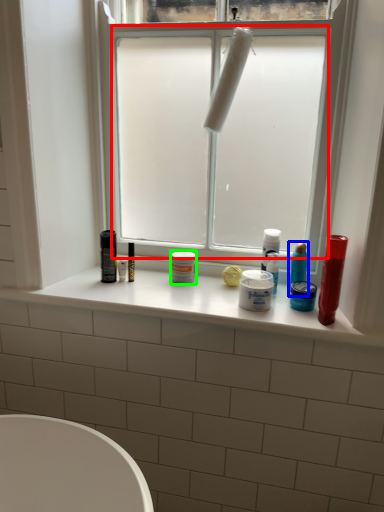
Question: Which is nearer to the window screen (highlighted by a red box)? toiletry (highlighted by a blue box) or toiletry (highlighted by a green box).

Choices:
 (A) toiletry
 (B) toiletry

Answer: (B)